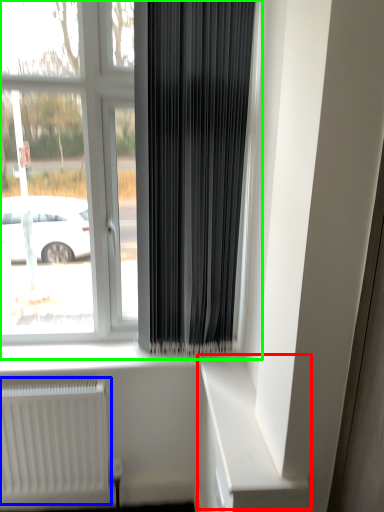
Question: Based on their relative distances, which object is farther from shelf (highlighted by a red box)? Choose from radiator (highlighted by a blue box) and window (highlighted by a green box).

Choices:
 (A) radiator
 (B) window

Answer: (B)